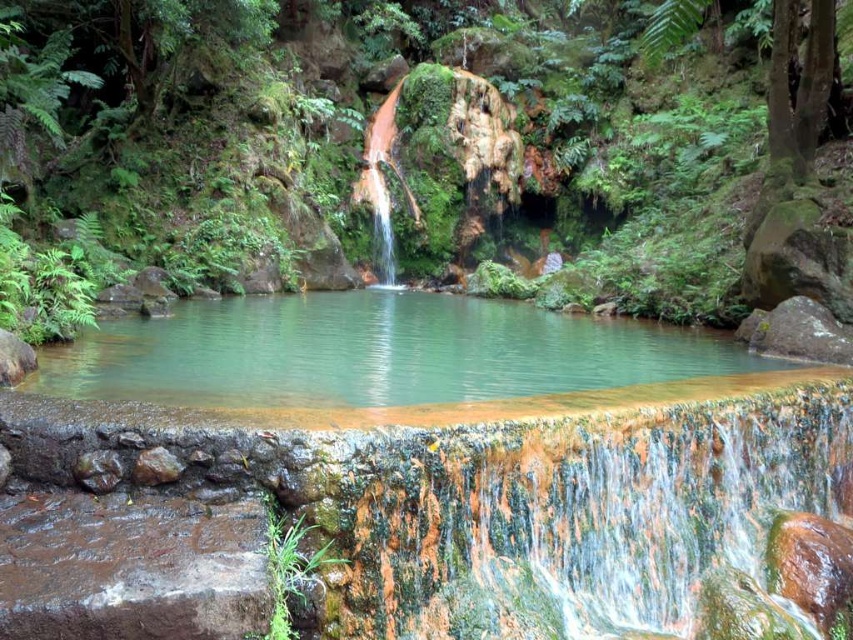
You are a hiker who wants to cross from the mossy rock to the waterfall. The path between them is narrow. If your backpack is 1.5 meters wide, can you safely pass through the gap between the green mossy rock at center and the translucent glass waterfall at center?

The distance between the green mossy rock at center and the translucent glass waterfall at center is 5.13 meters, which is wider than your backpack of 1.5 meters. Therefore, you can safely pass through the gap between them.

You are standing at the edge of the pool and see the point marked at coordinates (630,163). What does this point indicate in the scene?

The point at coordinates (630,163) marks the location of the green mossy rock at center in the scene.